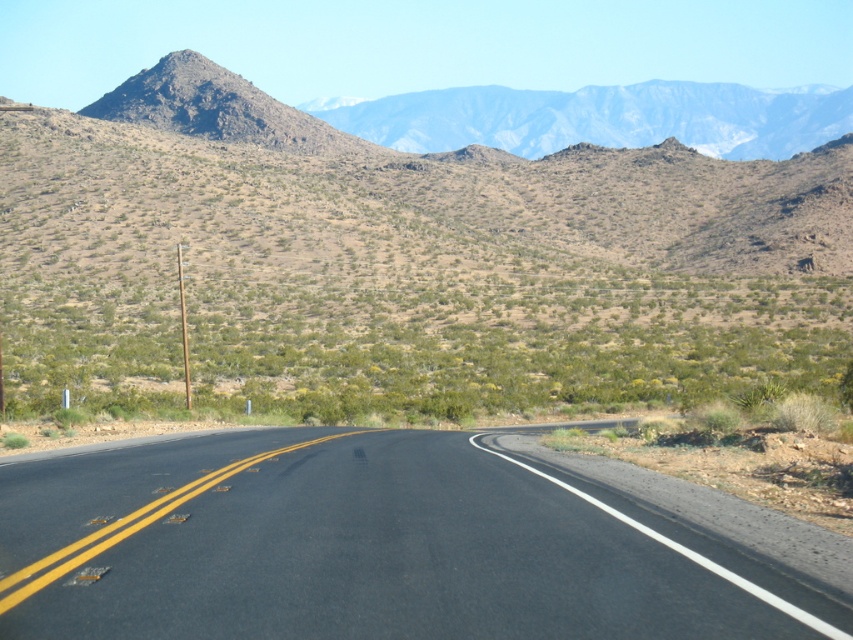
You are a driver approaching the black asphalt road at center and the rugged rock mountain range at upper center. Which object appears larger in the image?

The rugged rock mountain range at upper center appears larger than the black asphalt road at center.